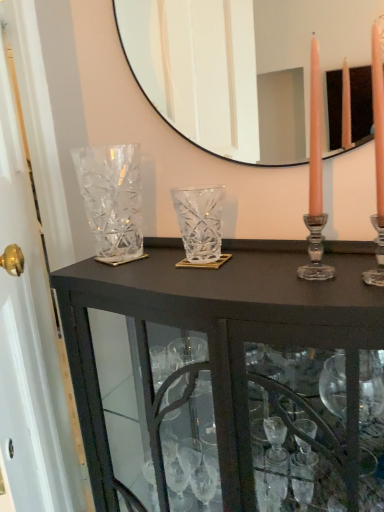
Question: From a real-world perspective, does clear glass door at left stand above clear glass cabinet at center?

Choices:
 (A) no
 (B) yes

Answer: (B)

Question: Is clear glass door at left beside clear glass cabinet at center?

Choices:
 (A) no
 (B) yes

Answer: (A)

Question: From the image's perspective, is clear glass door at left located above clear glass cabinet at center?

Choices:
 (A) yes
 (B) no

Answer: (A)

Question: Considering the relative sizes of clear glass door at left and clear glass cabinet at center in the image provided, is clear glass door at left bigger than clear glass cabinet at center?

Choices:
 (A) no
 (B) yes

Answer: (B)

Question: From the image's perspective, would you say clear glass door at left is shown under clear glass cabinet at center?

Choices:
 (A) yes
 (B) no

Answer: (B)

Question: Is clear glass cabinet at center surrounded by clear glass door at left?

Choices:
 (A) no
 (B) yes

Answer: (A)

Question: Considering the relative sizes of clear crystal vase at left, the first glass vase viewed from the left, and clear glass door at left in the image provided, is clear crystal vase at left, the first glass vase viewed from the left, shorter than clear glass door at left?

Choices:
 (A) yes
 (B) no

Answer: (A)

Question: Is clear crystal vase at left, the first glass vase viewed from the left, positioned in front of clear glass door at left?

Choices:
 (A) yes
 (B) no

Answer: (B)

Question: Can you confirm if clear crystal vase at left, arranged as the 2th glass vase when viewed from the right, is wider than clear glass door at left?

Choices:
 (A) yes
 (B) no

Answer: (B)

Question: Is clear crystal vase at left, the first glass vase viewed from the left, aimed at clear glass door at left?

Choices:
 (A) yes
 (B) no

Answer: (A)

Question: From the image's perspective, is clear crystal vase at left, the first glass vase viewed from the left, located beneath clear glass door at left?

Choices:
 (A) yes
 (B) no

Answer: (B)

Question: From a real-world perspective, is clear crystal vase at left, arranged as the 2th glass vase when viewed from the right, located beneath clear glass door at left?

Choices:
 (A) no
 (B) yes

Answer: (A)

Question: From a real-world perspective, is clear crystal vase at left, the first glass vase viewed from the left, over clear glass mirror at upper center?

Choices:
 (A) no
 (B) yes

Answer: (A)